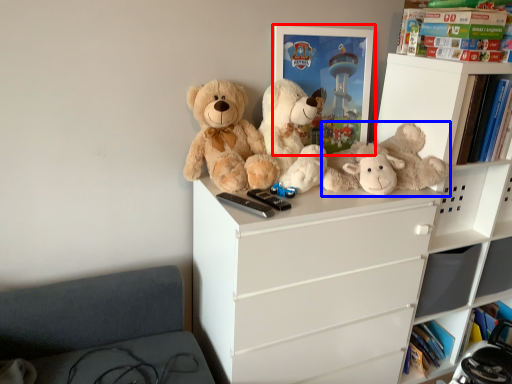
Question: Which object appears farthest to the camera in this image, picture frame (highlighted by a red box) or teddy bear (highlighted by a blue box)?

Choices:
 (A) picture frame
 (B) teddy bear

Answer: (A)